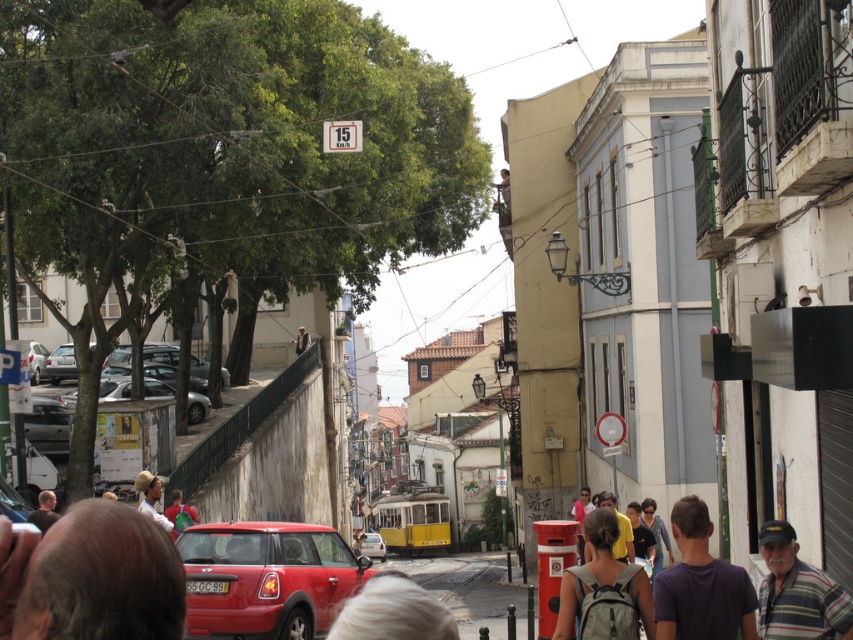
Question: Is metallic silver car at center bigger than metallic red car at center?

Choices:
 (A) no
 (B) yes

Answer: (B)

Question: Can you confirm if dark brown hair at lower left is thinner than light brown straw hat at center?

Choices:
 (A) yes
 (B) no

Answer: (A)

Question: Which object is farther from the camera taking this photo?

Choices:
 (A) matte silver car at center
 (B) purple cotton t-shirt at center
 (C) blonde hair at center

Answer: (A)

Question: Which point appears closest to the camera in this image?

Choices:
 (A) (24, 422)
 (B) (62, 358)
 (C) (200, 417)

Answer: (A)

Question: Among these objects, which one is nearest to the camera?

Choices:
 (A) light brown straw hat at center
 (B) light brown hair at lower left

Answer: (B)

Question: Can you confirm if light brown hair at lower left is positioned to the left of light brown wooden sign at upper center?

Choices:
 (A) no
 (B) yes

Answer: (A)